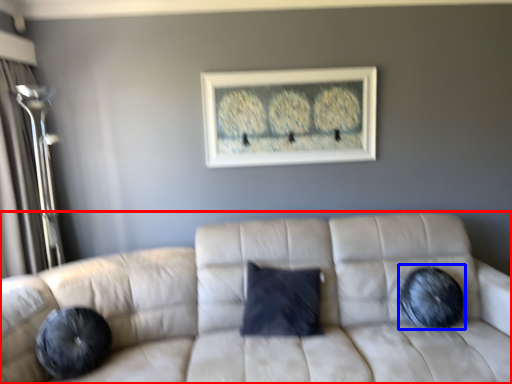
Question: Which object appears closest to the camera in this image, studio couch (highlighted by a red box) or pillow (highlighted by a blue box)?

Choices:
 (A) studio couch
 (B) pillow

Answer: (A)